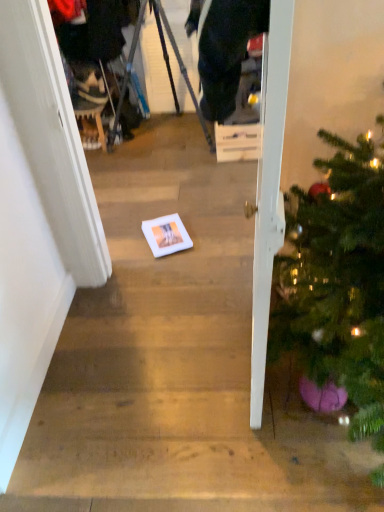
Question: Considering the relative positions of metallic tripod at center and white glossy door at right in the image provided, is metallic tripod at center to the right of white glossy door at right from the viewer's perspective?

Choices:
 (A) yes
 (B) no

Answer: (B)

Question: Can white glossy door at right be found inside metallic tripod at center?

Choices:
 (A) yes
 (B) no

Answer: (B)

Question: From a real-world perspective, is metallic tripod at center positioned under white glossy door at right based on gravity?

Choices:
 (A) yes
 (B) no

Answer: (A)

Question: From the image's perspective, does metallic tripod at center appear lower than white glossy door at right?

Choices:
 (A) yes
 (B) no

Answer: (B)

Question: Considering the relative positions of metallic tripod at center and white glossy door at right in the image provided, is metallic tripod at center behind white glossy door at right?

Choices:
 (A) no
 (B) yes

Answer: (B)

Question: From the image's perspective, is metallic tripod at center located above white glossy door at right?

Choices:
 (A) yes
 (B) no

Answer: (A)

Question: Can you confirm if white cardboard box at center is bigger than metallic tripod at center?

Choices:
 (A) yes
 (B) no

Answer: (B)

Question: Is white cardboard box at center to the left of metallic tripod at center from the viewer's perspective?

Choices:
 (A) no
 (B) yes

Answer: (A)

Question: From the image's perspective, is white cardboard box at center on top of metallic tripod at center?

Choices:
 (A) no
 (B) yes

Answer: (A)

Question: Can you confirm if white cardboard box at center is shorter than metallic tripod at center?

Choices:
 (A) no
 (B) yes

Answer: (B)

Question: Considering the relative sizes of white cardboard box at center and metallic tripod at center in the image provided, is white cardboard box at center wider than metallic tripod at center?

Choices:
 (A) yes
 (B) no

Answer: (B)

Question: Is metallic tripod at center located within white cardboard box at center?

Choices:
 (A) yes
 (B) no

Answer: (B)

Question: From the image's perspective, does white cardboard box at center appear lower than white glossy door at right?

Choices:
 (A) no
 (B) yes

Answer: (A)